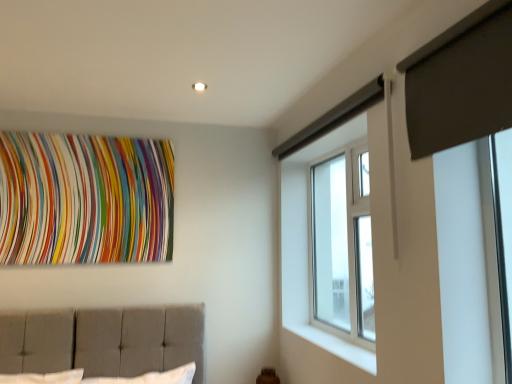
Question: Is clear glass window at upper right positioned in front of white smooth window sill at lower right?

Choices:
 (A) no
 (B) yes

Answer: (A)

Question: Is clear glass window at upper right looking in the opposite direction of white smooth window sill at lower right?

Choices:
 (A) no
 (B) yes

Answer: (A)

Question: Does clear glass window at upper right have a lesser height compared to white smooth window sill at lower right?

Choices:
 (A) no
 (B) yes

Answer: (A)

Question: Does clear glass window at upper right come behind white smooth window sill at lower right?

Choices:
 (A) yes
 (B) no

Answer: (A)

Question: Does clear glass window at upper right contain white smooth window sill at lower right?

Choices:
 (A) yes
 (B) no

Answer: (B)

Question: From a real-world perspective, is white smooth window sill at lower right above or below clear glass window at upper right?

Choices:
 (A) above
 (B) below

Answer: (B)

Question: From the image's perspective, is white smooth window sill at lower right positioned above or below clear glass window at upper right?

Choices:
 (A) above
 (B) below

Answer: (B)

Question: In the image, is white smooth window sill at lower right positioned in front of or behind clear glass window at upper right?

Choices:
 (A) front
 (B) behind

Answer: (A)

Question: Considering the positions of white smooth window sill at lower right and clear glass window at upper right in the image, is white smooth window sill at lower right taller or shorter than clear glass window at upper right?

Choices:
 (A) tall
 (B) short

Answer: (B)

Question: Is clear glass window at upper right bigger or smaller than multicolored fabric at upper left?

Choices:
 (A) small
 (B) big

Answer: (B)

Question: Is point (350, 162) closer or farther from the camera than point (39, 251)?

Choices:
 (A) closer
 (B) farther

Answer: (A)

Question: Considering the positions of clear glass window at upper right and multicolored fabric at upper left in the image, is clear glass window at upper right taller or shorter than multicolored fabric at upper left?

Choices:
 (A) short
 (B) tall

Answer: (B)

Question: Choose the correct answer: Is clear glass window at upper right inside multicolored fabric at upper left or outside it?

Choices:
 (A) outside
 (B) inside

Answer: (A)

Question: Looking at their shapes, would you say dark gray fabric at upper right is wider or thinner than clear glass window at upper right?

Choices:
 (A) wide
 (B) thin

Answer: (B)

Question: Relative to clear glass window at upper right, is dark gray fabric at upper right in front or behind?

Choices:
 (A) front
 (B) behind

Answer: (A)